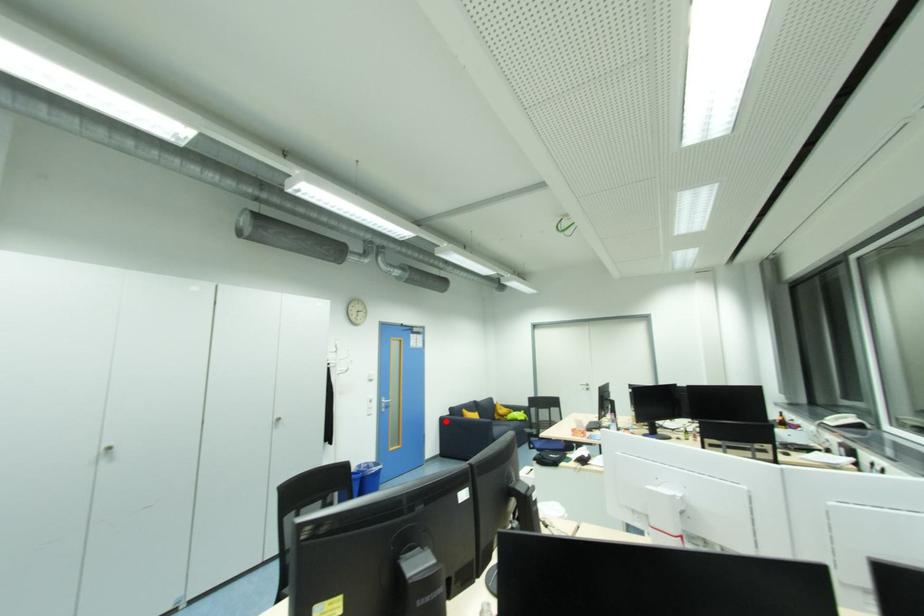
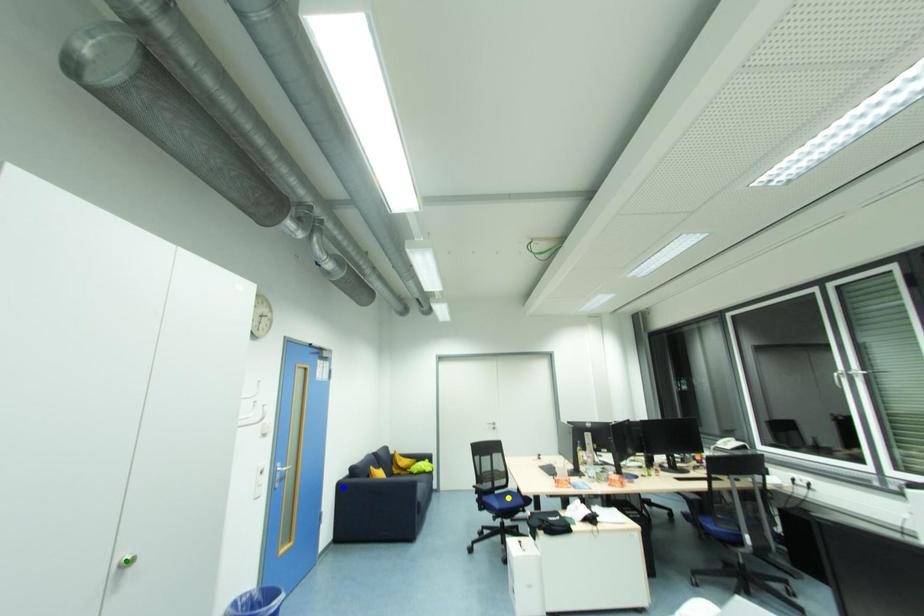
Question: I am providing you with two images of the same scene from different viewpoints. A red point is marked on the first image. You are given multiple points on the second image. Which mark in image 2 goes with the point in image 1?

Choices:
 (A) yellow point
 (B) blue point
 (C) green point

Answer: (B)